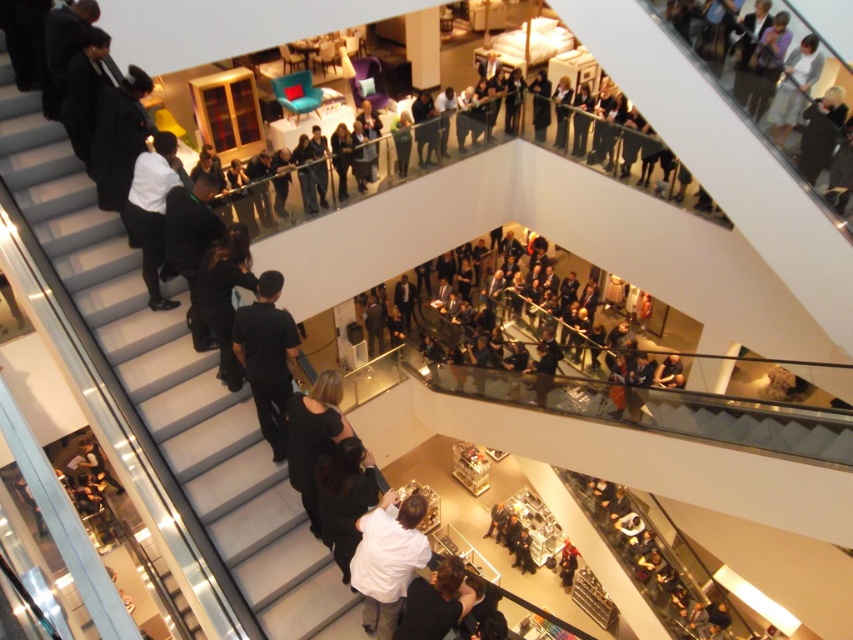
Who is higher up, black matte dress at center or dark brown leather jacket at lower center?

black matte dress at center

Is black matte dress at center in front of dark brown leather jacket at lower center?

No, black matte dress at center is further to the viewer.

The image size is (853, 640). I want to click on black matte dress at center, so click(x=221, y=298).

The image size is (853, 640). Identify the location of black matte dress at center. (221, 298).

Can you confirm if white matte shirt at center is positioned to the right of white matte shirt at left?

Yes, white matte shirt at center is to the right of white matte shirt at left.

Does point (397, 579) come in front of point (154, 310)?

Yes, it is in front of point (154, 310).

Is point (396, 589) positioned in front of point (141, 211)?

Yes, point (396, 589) is in front of point (141, 211).

Locate an element on the screen. This screenshot has width=853, height=640. white matte shirt at center is located at coordinates (387, 557).

Who is positioned more to the right, white matte shirt at center or black matte pants at left?

From the viewer's perspective, white matte shirt at center appears more on the right side.

Is white matte shirt at center shorter than black matte pants at left?

Indeed, white matte shirt at center has a lesser height compared to black matte pants at left.

Is point (402, 573) positioned in front of point (245, 310)?

Yes.

The image size is (853, 640). I want to click on white matte shirt at center, so click(387, 557).